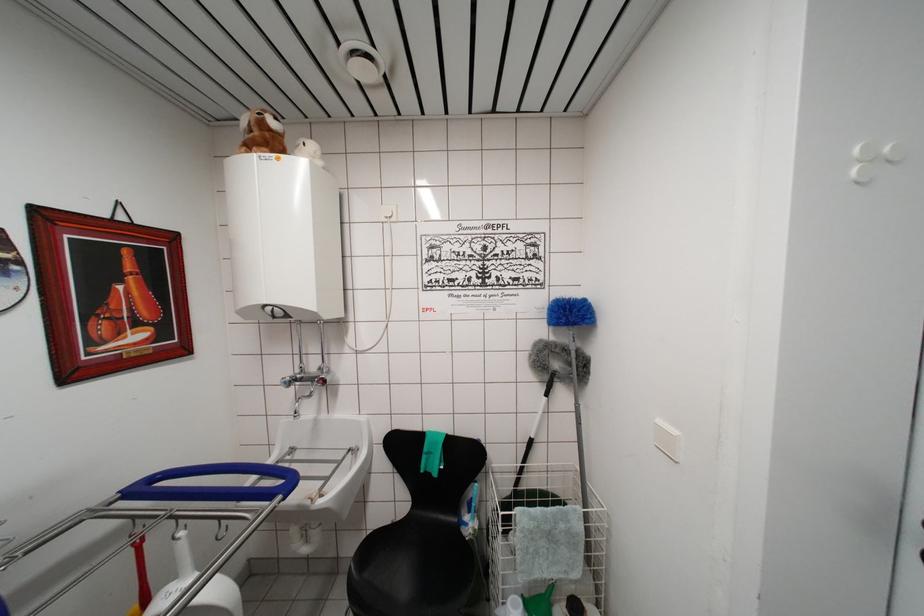
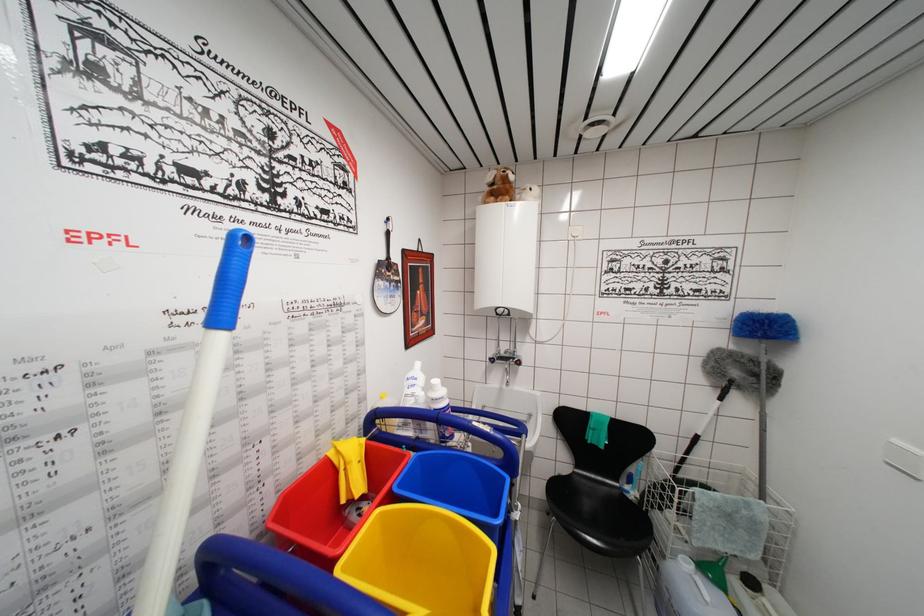
In the scene shown: The images are taken continuously from a first-person perspective. In which direction are you moving?

The cameraman moved toward left, backward.